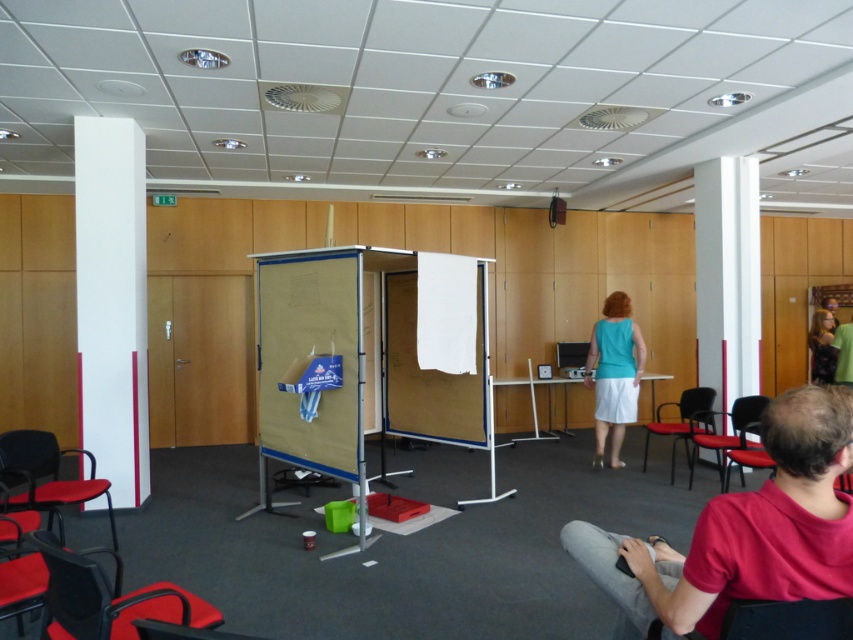
Question: Can you confirm if white cardboard at center is smaller than black plastic chair at lower left?

Choices:
 (A) no
 (B) yes

Answer: (A)

Question: Which of the following is the closest to the observer?

Choices:
 (A) teal fabric dress at center
 (B) white smooth pillar at left
 (C) metallic black chair at right

Answer: (B)

Question: Is white glossy pillar at right bigger than black leather chair at lower right?

Choices:
 (A) no
 (B) yes

Answer: (B)

Question: Which point appears closest to the camera in this image?

Choices:
 (A) (636, 392)
 (B) (54, 552)
 (C) (815, 340)

Answer: (B)

Question: Can you confirm if teal fabric dress at center is positioned above red fabric chair at left?

Choices:
 (A) no
 (B) yes

Answer: (B)

Question: Which point appears closest to the camera in this image?

Choices:
 (A) (773, 509)
 (B) (805, 620)

Answer: (A)